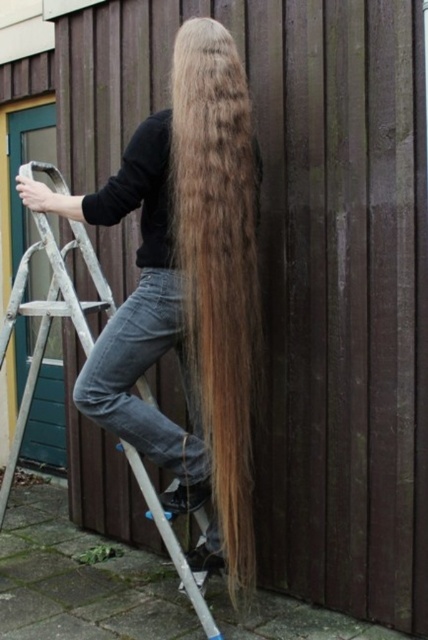
Between golden brown silky hair at center and metallic silver ladder at center, which one has less height?

With less height is metallic silver ladder at center.

Between golden brown silky hair at center and metallic silver ladder at center, which one appears on the left side from the viewer's perspective?

From the viewer's perspective, metallic silver ladder at center appears more on the left side.

Where is `golden brown silky hair at center`? The width and height of the screenshot is (428, 640). golden brown silky hair at center is located at coordinates (217, 273).

This screenshot has width=428, height=640. I want to click on golden brown silky hair at center, so click(x=217, y=273).